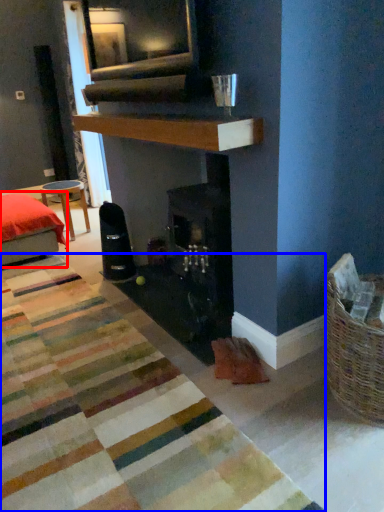
Question: Which object is closer to the camera taking this photo, furniture (highlighted by a red box) or mat (highlighted by a blue box)?

Choices:
 (A) furniture
 (B) mat

Answer: (B)